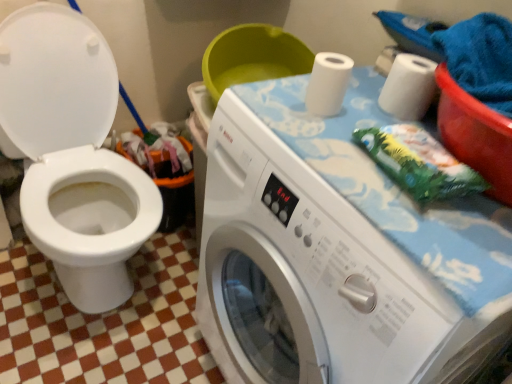
Question: Can you confirm if white matte toilet paper at upper right, the first toilet paper from the right, is bigger than orange plastic recycling bin at lower left?

Choices:
 (A) no
 (B) yes

Answer: (A)

Question: Considering the relative sizes of white matte toilet paper at upper right, marked as the 2th toilet paper in a left-to-right arrangement, and orange plastic recycling bin at lower left in the image provided, is white matte toilet paper at upper right, marked as the 2th toilet paper in a left-to-right arrangement, wider than orange plastic recycling bin at lower left?

Choices:
 (A) yes
 (B) no

Answer: (B)

Question: Can you see white matte toilet paper at upper right, the first toilet paper from the right, touching orange plastic recycling bin at lower left?

Choices:
 (A) no
 (B) yes

Answer: (A)

Question: Does white matte toilet paper at upper right, the first toilet paper from the right, appear on the left side of orange plastic recycling bin at lower left?

Choices:
 (A) no
 (B) yes

Answer: (A)

Question: Is white matte toilet paper at upper right, the first toilet paper from the right, thinner than orange plastic recycling bin at lower left?

Choices:
 (A) yes
 (B) no

Answer: (A)

Question: Considering the positions of point (401, 84) and point (178, 178), is point (401, 84) closer or farther from the camera than point (178, 178)?

Choices:
 (A) farther
 (B) closer

Answer: (B)

Question: Choose the correct answer: Is white matte toilet paper at upper right, the first toilet paper from the right, inside orange plastic recycling bin at lower left or outside it?

Choices:
 (A) inside
 (B) outside

Answer: (B)

Question: In the image, is white matte toilet paper at upper right, the first toilet paper from the right, positioned in front of or behind orange plastic recycling bin at lower left?

Choices:
 (A) front
 (B) behind

Answer: (A)

Question: Looking at their shapes, would you say white matte toilet paper at upper right, the first toilet paper from the right, is wider or thinner than orange plastic recycling bin at lower left?

Choices:
 (A) thin
 (B) wide

Answer: (A)

Question: In terms of width, does white matte toilet paper at upper right, marked as the 2th toilet paper in a left-to-right arrangement, look wider or thinner when compared to white plastic washing machine at center?

Choices:
 (A) thin
 (B) wide

Answer: (A)

Question: From their relative heights in the image, would you say white matte toilet paper at upper right, marked as the 2th toilet paper in a left-to-right arrangement, is taller or shorter than white plastic washing machine at center?

Choices:
 (A) tall
 (B) short

Answer: (B)

Question: In terms of size, does white matte toilet paper at upper right, the first toilet paper from the right, appear bigger or smaller than white plastic washing machine at center?

Choices:
 (A) big
 (B) small

Answer: (B)

Question: From a real-world perspective, is white matte toilet paper at upper right, the first toilet paper from the right, above or below white plastic washing machine at center?

Choices:
 (A) below
 (B) above

Answer: (B)

Question: Considering the positions of white glossy toilet at left and white matte toilet paper at upper right, which is the 1th toilet paper in left-to-right order, in the image, is white glossy toilet at left bigger or smaller than white matte toilet paper at upper right, which is the 1th toilet paper in left-to-right order,?

Choices:
 (A) small
 (B) big

Answer: (B)

Question: From their relative heights in the image, would you say white glossy toilet at left is taller or shorter than white matte toilet paper at upper right, the 2th toilet paper in the right-to-left sequence?

Choices:
 (A) tall
 (B) short

Answer: (A)